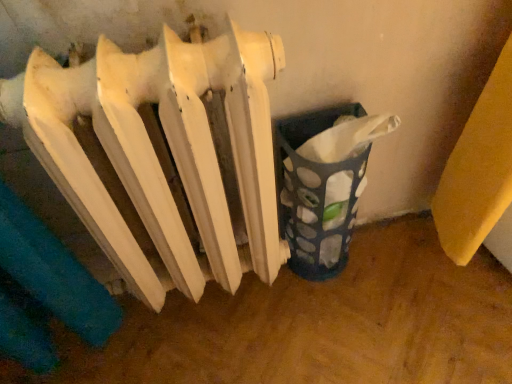
You are a GUI agent. You are given a task and a screenshot of the screen. Output one action in this format:
    pyautogui.click(x=<x>, y=<y>)
    Task: Click on the spots to the right of translucent plastic basket at lower right
    This screenshot has height=384, width=512.
    Given the screenshot: What is the action you would take?
    pyautogui.click(x=397, y=263)